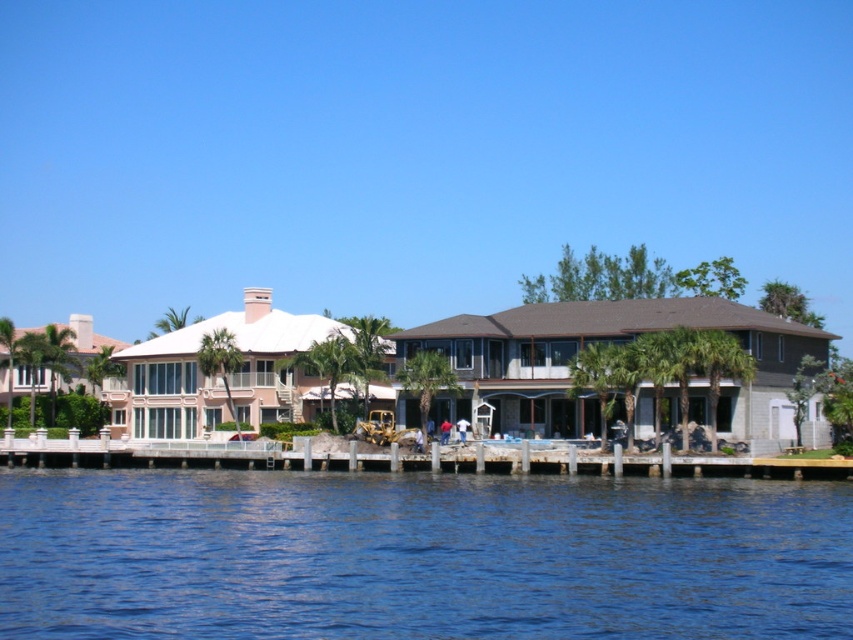
You are planning to build a small shed on the white concrete dock at lower center. Given that the blue water at lower center is larger in size than the dock, will the dock have enough space for the shed without encroaching into the water area?

The blue water at lower center is bigger than the white concrete dock at lower center, meaning the dock is smaller. Since the dock itself is smaller than the water area, constructing a shed on the dock may not leave enough space, as the dock might be too narrow. To ensure the shed fits without encroaching into the water, you should measure the dock dimensions carefully.

You are standing on the white concrete dock at lower center and want to see the blue water at lower center. In which direction should you look?

The blue water at lower center is below the white concrete dock at lower center, so you should look downward to see it.

You are a delivery drone flying over the waterfront residential area. Your GPS shows that you need to land on the dock while avoiding the blue water at lower center. According to the coordinates provided, where should you aim to land?

The blue water at lower center is located at point (419, 556), so you should aim to land on the dock away from that coordinate to avoid it.